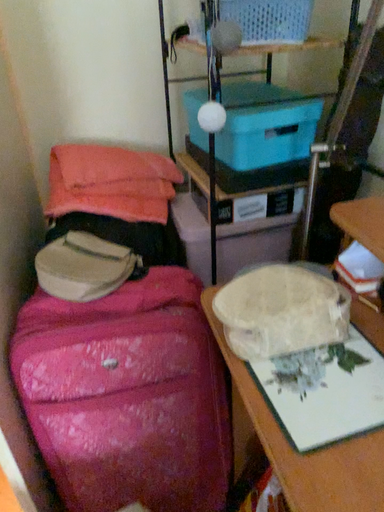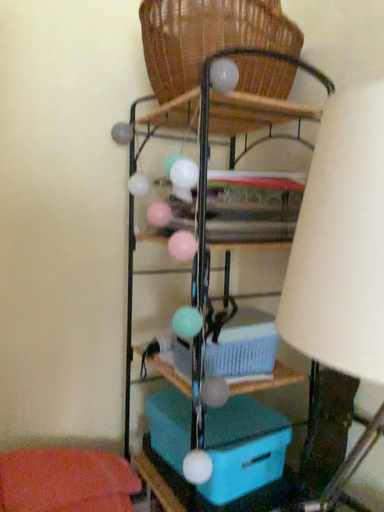
Question: Which way did the camera rotate in the video?

Choices:
 (A) rotated right
 (B) rotated left

Answer: (A)